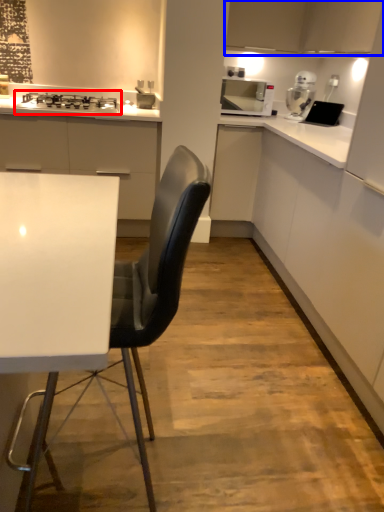
Question: Among these objects, which one is farthest to the camera, gas stove (highlighted by a red box) or cabinetry (highlighted by a blue box)?

Choices:
 (A) gas stove
 (B) cabinetry

Answer: (A)